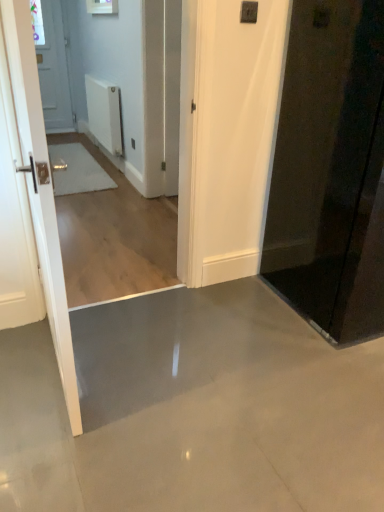
Question: Relative to white matte radiator at upper center, is black glossy door at right, the 2th door in the left-to-right sequence, in front or behind?

Choices:
 (A) front
 (B) behind

Answer: (A)

Question: Considering the positions of black glossy door at right, the first door in the right-to-left sequence, and white matte radiator at upper center in the image, is black glossy door at right, the first door in the right-to-left sequence, wider or thinner than white matte radiator at upper center?

Choices:
 (A) thin
 (B) wide

Answer: (B)

Question: Which object is positioned closest to the black glossy door at right, the first door in the right-to-left sequence?

Choices:
 (A) white matte radiator at upper center
 (B) white glossy door at left, arranged as the 1th door when viewed from the left

Answer: (B)

Question: Which is farther from the white matte radiator at upper center?

Choices:
 (A) black glossy door at right, the first door in the right-to-left sequence
 (B) white glossy door at left, arranged as the 1th door when viewed from the left

Answer: (B)